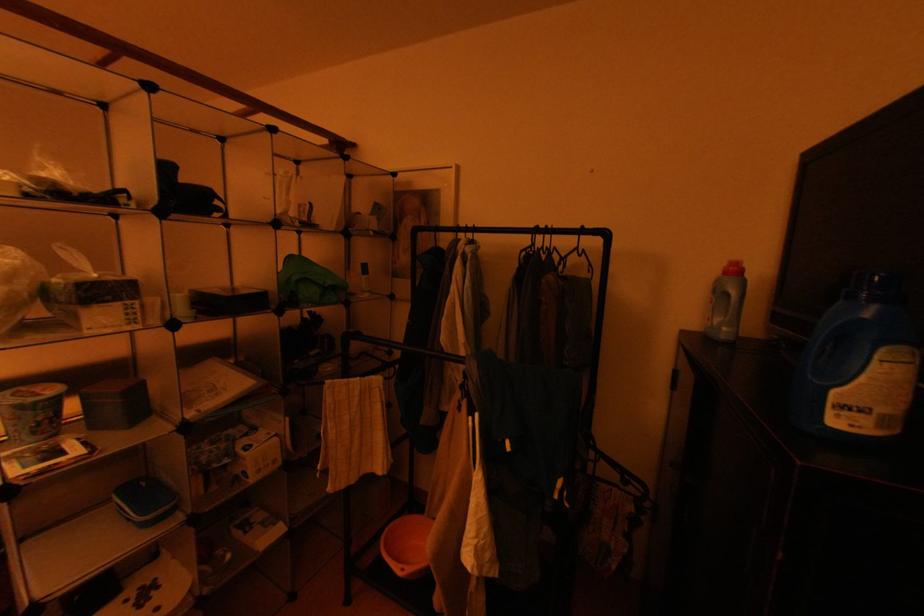
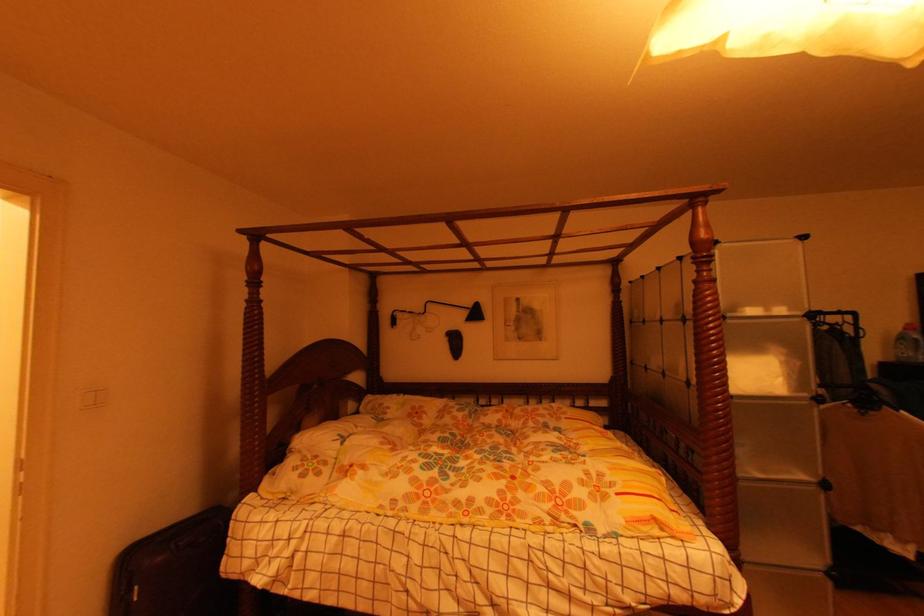
Question: What movement of the cameraman would produce the second image?

Choices:
 (A) Left
 (B) Right
 (C) Forward
 (D) Backward

Answer: (A)